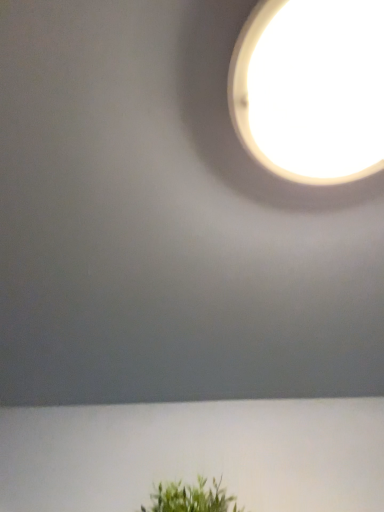
Identify the location of green leafy plant at lower center. (191, 498).

In order to face green leafy plant at lower center, should I rotate leftwards or rightwards?

It's best to rotate left around 1.224 degrees.

The image size is (384, 512). What do you see at coordinates (191, 498) in the screenshot? I see `green leafy plant at lower center` at bounding box center [191, 498].

Image resolution: width=384 pixels, height=512 pixels. Describe the element at coordinates (308, 91) in the screenshot. I see `white glossy lampshade at upper center` at that location.

At what (x,y) coordinates should I click in order to perform the action: click on white glossy lampshade at upper center. Please return your answer as a coordinate pair (x, y). The height and width of the screenshot is (512, 384). Looking at the image, I should click on (308, 91).

Find the location of a particular element. The image size is (384, 512). green leafy plant at lower center is located at coordinates (191, 498).

Visually, is green leafy plant at lower center positioned to the left or to the right of white glossy lampshade at upper center?

green leafy plant at lower center is to the left of white glossy lampshade at upper center.

Which object is closer to the camera, green leafy plant at lower center or white glossy lampshade at upper center?

white glossy lampshade at upper center is more forward.

Does point (234, 509) appear closer or farther from the camera than point (315, 26)?

Point (234, 509).

From the image's perspective, relative to white glossy lampshade at upper center, is green leafy plant at lower center above or below?

green leafy plant at lower center is below white glossy lampshade at upper center.

From a real-world perspective, is green leafy plant at lower center physically below white glossy lampshade at upper center?

Correct, in the physical world, green leafy plant at lower center is lower than white glossy lampshade at upper center.

Considering the relative sizes of green leafy plant at lower center and white glossy lampshade at upper center in the image provided, is green leafy plant at lower center thinner than white glossy lampshade at upper center?

Indeed, green leafy plant at lower center has a lesser width compared to white glossy lampshade at upper center.

Is green leafy plant at lower center taller or shorter than white glossy lampshade at upper center?

In the image, green leafy plant at lower center appears to be taller than white glossy lampshade at upper center.

Considering the sizes of objects green leafy plant at lower center and white glossy lampshade at upper center in the image provided, who is bigger, green leafy plant at lower center or white glossy lampshade at upper center?

green leafy plant at lower center.

Choose the correct answer: Is green leafy plant at lower center inside white glossy lampshade at upper center or outside it?

green leafy plant at lower center is spatially situated outside white glossy lampshade at upper center.

Is green leafy plant at lower center next to white glossy lampshade at upper center and touching it?

No, green leafy plant at lower center is not with white glossy lampshade at upper center.

Is green leafy plant at lower center positioned with its back to white glossy lampshade at upper center?

No, white glossy lampshade at upper center is not at the back of green leafy plant at lower center.

Can you tell me how much green leafy plant at lower center and white glossy lampshade at upper center differ in facing direction?

They differ by 89.4 degrees in their facing directions.

How far apart are green leafy plant at lower center and white glossy lampshade at upper center?

green leafy plant at lower center and white glossy lampshade at upper center are 63.82 centimeters apart from each other.

Locate an element on the screen. The image size is (384, 512). houseplant below the white glossy lampshade at upper center (from a real-world perspective) is located at coordinates (191, 498).

Which object is positioned more to the right, white glossy lampshade at upper center or green leafy plant at lower center?

white glossy lampshade at upper center is more to the right.

Between white glossy lampshade at upper center and green leafy plant at lower center, which one is positioned behind?

green leafy plant at lower center is further from the camera.

Does point (307, 99) appear closer or farther from the camera than point (152, 501)?

Point (307, 99) appears to be closer to the viewer than point (152, 501).

From the image's perspective, between white glossy lampshade at upper center and green leafy plant at lower center, who is located below?

green leafy plant at lower center.

From the picture: From a real-world perspective, does white glossy lampshade at upper center sit lower than green leafy plant at lower center?

Actually, white glossy lampshade at upper center is physically above green leafy plant at lower center in the real world.

Between white glossy lampshade at upper center and green leafy plant at lower center, which one has larger width?

white glossy lampshade at upper center.

Which of these two, white glossy lampshade at upper center or green leafy plant at lower center, stands shorter?

white glossy lampshade at upper center is shorter.

Does white glossy lampshade at upper center have a larger size compared to green leafy plant at lower center?

No, white glossy lampshade at upper center is not bigger than green leafy plant at lower center.

Is white glossy lampshade at upper center located outside green leafy plant at lower center?

Yes, white glossy lampshade at upper center is outside of green leafy plant at lower center.

Would you consider white glossy lampshade at upper center to be distant from green leafy plant at lower center?

That's not correct — white glossy lampshade at upper center is a little close to green leafy plant at lower center.

Does white glossy lampshade at upper center turn towards green leafy plant at lower center?

No, white glossy lampshade at upper center is not oriented towards green leafy plant at lower center.

What's the angular difference between white glossy lampshade at upper center and green leafy plant at lower center's facing directions?

white glossy lampshade at upper center and green leafy plant at lower center are facing 89.4 degrees away from each other.

You are a GUI agent. You are given a task and a screenshot of the screen. Output one action in this format:
    pyautogui.click(x=<x>, y=<y>)
    Task: Click on the houseplant behind the white glossy lampshade at upper center
    
    Given the screenshot: What is the action you would take?
    pyautogui.click(x=191, y=498)

Locate an element on the screen. The height and width of the screenshot is (512, 384). lamp on the right of green leafy plant at lower center is located at coordinates (308, 91).

Where is `lamp that appears above the green leafy plant at lower center (from a real-world perspective)`? lamp that appears above the green leafy plant at lower center (from a real-world perspective) is located at coordinates (308, 91).